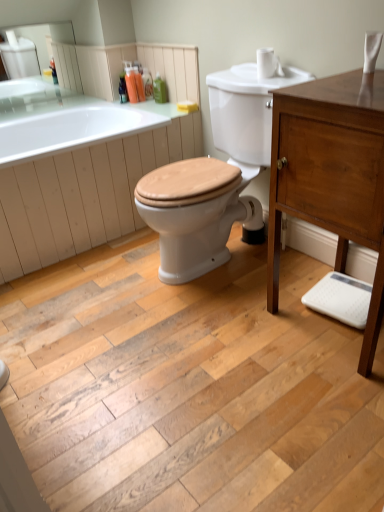
Question: In which direction should I rotate to look at translucent plastic soap dispenser at upper center, placed as the fourth toiletry when sorted from right to left?

Choices:
 (A) right
 (B) left

Answer: (B)

Question: From a real-world perspective, is white matte toilet paper at upper right under translucent plastic soap dispenser at upper center, the 2th toiletry when ordered from right to left?

Choices:
 (A) no
 (B) yes

Answer: (A)

Question: Is there a large distance between white matte toilet paper at upper right and translucent plastic soap dispenser at upper center, positioned as the third toiletry in left-to-right order?

Choices:
 (A) no
 (B) yes

Answer: (B)

Question: Is white matte toilet paper at upper right at the left side of translucent plastic soap dispenser at upper center, the 2th toiletry when ordered from right to left?

Choices:
 (A) no
 (B) yes

Answer: (A)

Question: Is white matte toilet paper at upper right closer to the viewer compared to translucent plastic soap dispenser at upper center, the 2th toiletry when ordered from right to left?

Choices:
 (A) yes
 (B) no

Answer: (A)

Question: Considering the relative sizes of white matte toilet paper at upper right and translucent plastic soap dispenser at upper center, the 2th toiletry when ordered from right to left, in the image provided, is white matte toilet paper at upper right shorter than translucent plastic soap dispenser at upper center, the 2th toiletry when ordered from right to left,?

Choices:
 (A) yes
 (B) no

Answer: (A)

Question: Does white matte toilet paper at upper right appear on the right side of translucent plastic soap dispenser at upper center, positioned as the third toiletry in left-to-right order?

Choices:
 (A) no
 (B) yes

Answer: (B)

Question: Does white matte toilet paper at upper right have a lesser width compared to green plastic bottle at upper center, placed as the 1th toiletry when sorted from right to left?

Choices:
 (A) no
 (B) yes

Answer: (A)

Question: Is the position of white matte toilet paper at upper right less distant than that of green plastic bottle at upper center, placed as the 1th toiletry when sorted from right to left?

Choices:
 (A) no
 (B) yes

Answer: (B)

Question: Does white matte toilet paper at upper right have a smaller size compared to green plastic bottle at upper center, the 4th toiletry viewed from the left?

Choices:
 (A) no
 (B) yes

Answer: (A)

Question: Is white matte toilet paper at upper right not near green plastic bottle at upper center, placed as the 1th toiletry when sorted from right to left?

Choices:
 (A) yes
 (B) no

Answer: (B)

Question: Are white matte toilet paper at upper right and green plastic bottle at upper center, placed as the 1th toiletry when sorted from right to left, making contact?

Choices:
 (A) no
 (B) yes

Answer: (A)

Question: From the image's perspective, would you say white matte toilet paper at upper right is shown under green plastic bottle at upper center, placed as the 1th toiletry when sorted from right to left?

Choices:
 (A) no
 (B) yes

Answer: (B)

Question: Are white glossy bathtub at upper left and translucent plastic soap dispenser at upper center, placed as the fourth toiletry when sorted from right to left, located far from each other?

Choices:
 (A) yes
 (B) no

Answer: (B)